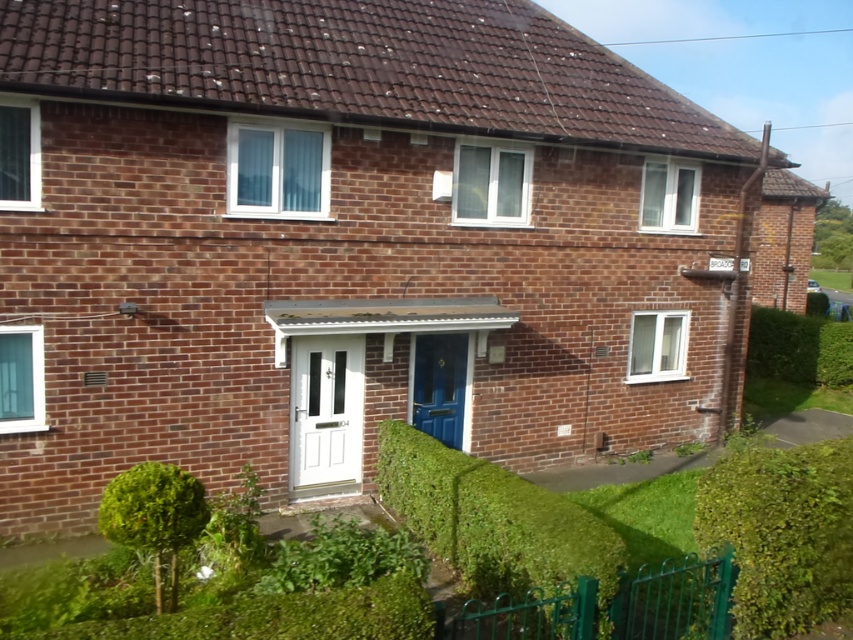
You are standing in front of the house and want to walk towards the green leafy hedge at lower right. Which direction should you move relative to the green leafy hedge at lower center?

You should move to the right of the green leafy hedge at lower center to reach the green leafy hedge at lower right since the green leafy hedge at lower center is in front of it.

You are a gardener who needs to trim the hedges in front of the house. Which hedge between the green leafy hedge at lower left and the green leafy hedge at right should you start with if you want to work on the shorter one first?

The green leafy hedge at lower left is shorter than the green leafy hedge at right, so you should start with the green leafy hedge at lower left.

You are standing in front of the house and see two green leafy hedges. One is the green leafy hedge at lower center, and the other is the green leafy hedge at lower right. Which one is positioned to the left when viewed from your perspective?

The green leafy hedge at lower center is positioned to the left of the green leafy hedge at lower right.